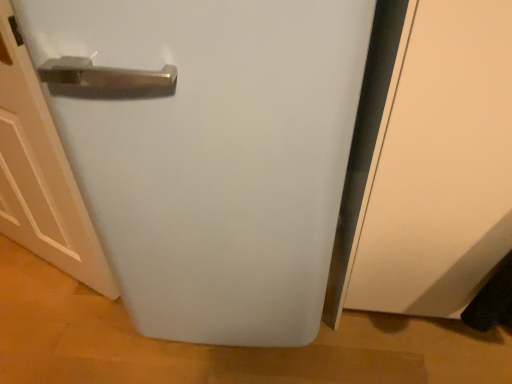
Question: Is white matte refrigerator at center wider than white matte door at left?

Choices:
 (A) yes
 (B) no

Answer: (A)

Question: Is white matte refrigerator at center shorter than white matte door at left?

Choices:
 (A) no
 (B) yes

Answer: (A)

Question: Is white matte door at left completely or partially inside white matte refrigerator at center?

Choices:
 (A) yes
 (B) no

Answer: (B)

Question: Are white matte refrigerator at center and white matte door at left making contact?

Choices:
 (A) no
 (B) yes

Answer: (A)

Question: Considering the relative positions of white matte refrigerator at center and white matte door at left in the image provided, is white matte refrigerator at center behind white matte door at left?

Choices:
 (A) yes
 (B) no

Answer: (B)

Question: Does white matte refrigerator at center have a smaller size compared to white matte door at left?

Choices:
 (A) no
 (B) yes

Answer: (A)

Question: Is white matte refrigerator at center surrounded by white matte door at left?

Choices:
 (A) yes
 (B) no

Answer: (B)

Question: Could you tell me if white matte door at left is facing white matte refrigerator at center?

Choices:
 (A) no
 (B) yes

Answer: (A)

Question: From a real-world perspective, is white matte door at left located higher than white matte refrigerator at center?

Choices:
 (A) yes
 (B) no

Answer: (B)

Question: Is there a large distance between white matte door at left and white matte refrigerator at center?

Choices:
 (A) yes
 (B) no

Answer: (B)

Question: Is white matte door at left at the left side of white matte refrigerator at center?

Choices:
 (A) no
 (B) yes

Answer: (B)

Question: Does white matte door at left have a greater height compared to white matte refrigerator at center?

Choices:
 (A) yes
 (B) no

Answer: (B)

Question: Visually, is white matte refrigerator at center positioned to the left or to the right of white matte door at left?

Choices:
 (A) right
 (B) left

Answer: (A)